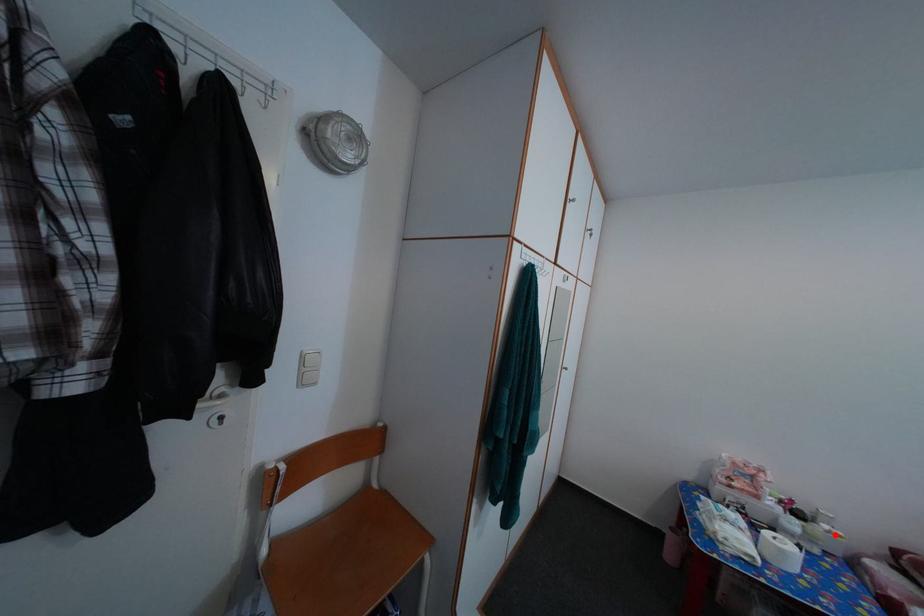
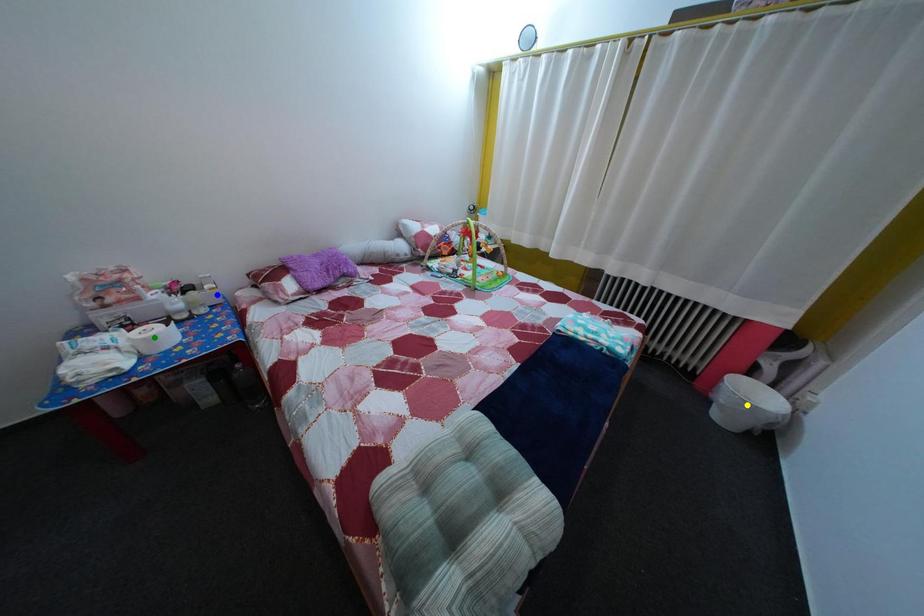
Question: I am providing you with two images of the same scene from different viewpoints. A red point is marked on the first image. You are given multiple points on the second image. Which point in image 2 is actually the same real-world point as the red point in image 1?

Choices:
 (A) green point
 (B) blue point
 (C) yellow point

Answer: (B)